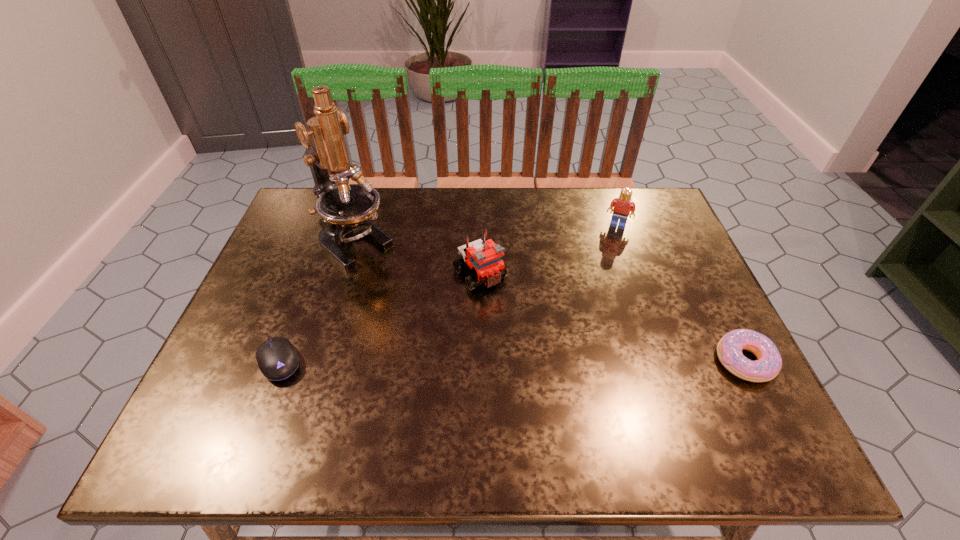
You are a GUI agent. You are given a task and a screenshot of the screen. Output one action in this format:
    pyautogui.click(x=<x>, y=<y>)
    Task: Click on the object at the near right corner
    Image resolution: width=960 pixels, height=540 pixels.
    Given the screenshot: What is the action you would take?
    pyautogui.click(x=729, y=349)

At what (x,y) coordinates should I click in order to perform the action: click on free space at the far edge of the desktop. Please return your answer as a coordinate pair (x, y). The height and width of the screenshot is (540, 960). Looking at the image, I should click on (578, 193).

This screenshot has height=540, width=960. What are the coordinates of `free space at the near edge of the desktop` in the screenshot? It's located at (333, 381).

You are a GUI agent. You are given a task and a screenshot of the screen. Output one action in this format:
    pyautogui.click(x=<x>, y=<y>)
    Task: Click on the free point at the left edge
    This screenshot has height=540, width=960.
    Given the screenshot: What is the action you would take?
    pyautogui.click(x=301, y=283)

I want to click on free space at the right edge, so click(x=687, y=345).

In the image, there is a desktop. Identify the location of blank space at the near left corner. (194, 410).

Identify the location of free space at the far right corner of the desktop. (643, 187).

At what (x,y) coordinates should I click in order to perform the action: click on free area in between the third object from right to left and the shortest object. Please return your answer as a coordinate pair (x, y). The image size is (960, 540). Looking at the image, I should click on (379, 318).

At what (x,y) coordinates should I click in order to perform the action: click on unoccupied area between the second shortest object and the farther Lego. Please return your answer as a coordinate pair (x, y). Looking at the image, I should click on (681, 293).

Locate an element on the screen. empty space between the second shortest object and the left Lego is located at coordinates (612, 318).